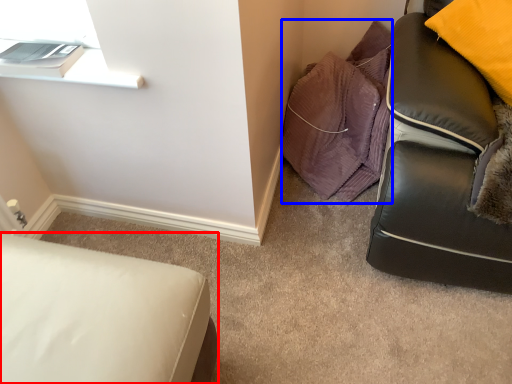
Question: Which object appears farthest to the camera in this image, furniture (highlighted by a red box) or material (highlighted by a blue box)?

Choices:
 (A) furniture
 (B) material

Answer: (B)